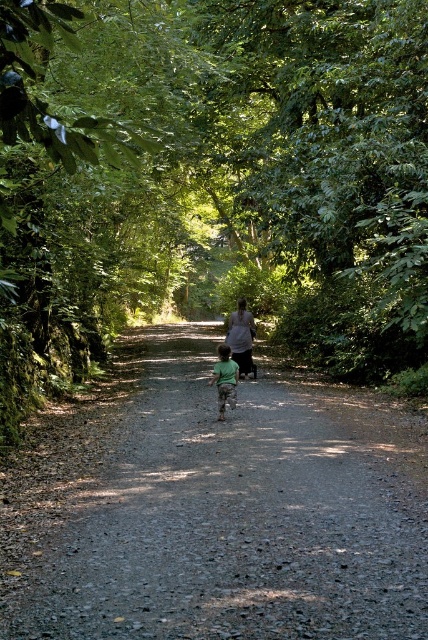
Question: Is the position of green leafy tree at center more distant than that of gravelly dirt path at center?

Choices:
 (A) no
 (B) yes

Answer: (A)

Question: Is green leafy tree at center above matte gray shirt at center?

Choices:
 (A) no
 (B) yes

Answer: (B)

Question: Which of these objects is positioned farthest from the matte gray shirt at center?

Choices:
 (A) green matte shirt at center
 (B) gravelly dirt path at center
 (C) green leafy tree at center

Answer: (C)

Question: Which point is closer to the camera taking this photo?

Choices:
 (A) (175, 188)
 (B) (222, 372)
 (C) (365, 564)

Answer: (C)

Question: Estimate the real-world distances between objects in this image. Which object is farther from the green matte shirt at center?

Choices:
 (A) gravelly dirt path at center
 (B) matte gray shirt at center

Answer: (B)

Question: Can you confirm if green leafy tree at center is positioned to the left of matte gray shirt at center?

Choices:
 (A) no
 (B) yes

Answer: (A)